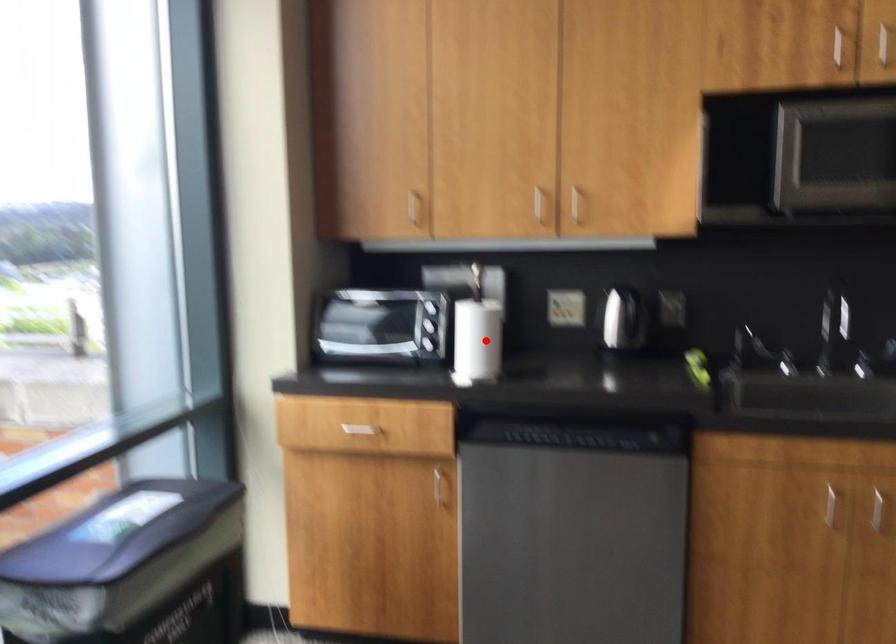
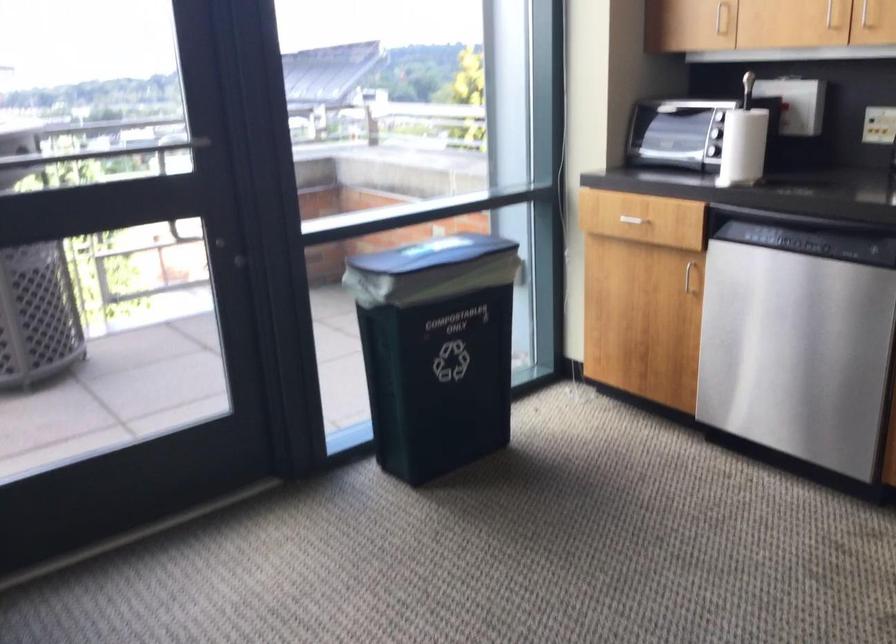
Where in the second image is the point corresponding to the highlighted location from the first image?

(743, 146)